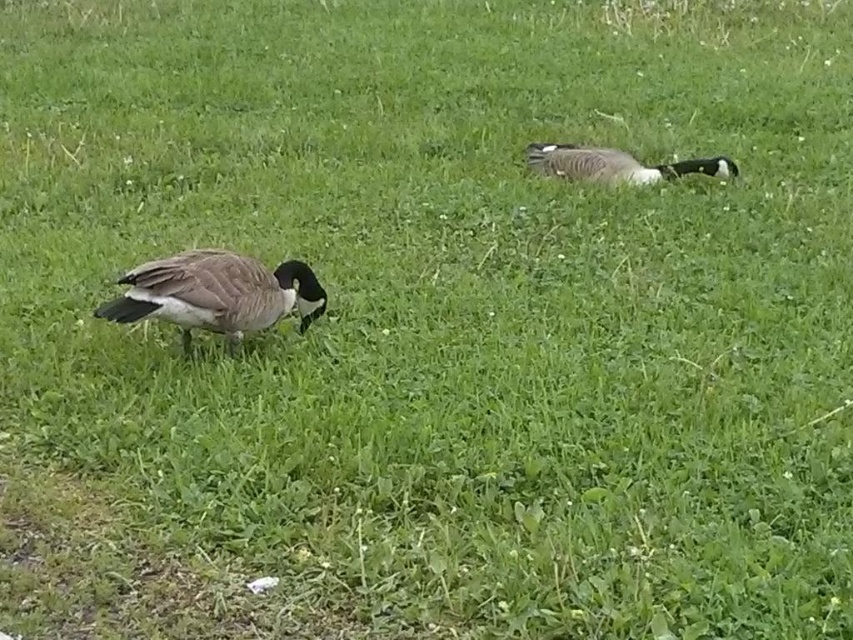
Question: Is brown feathered duck at left to the left of brown feathered duck at upper right from the viewer's perspective?

Choices:
 (A) yes
 (B) no

Answer: (A)

Question: Does brown feathered duck at left appear over brown feathered duck at upper right?

Choices:
 (A) no
 (B) yes

Answer: (A)

Question: Is brown feathered duck at left to the left of brown feathered duck at upper right from the viewer's perspective?

Choices:
 (A) no
 (B) yes

Answer: (B)